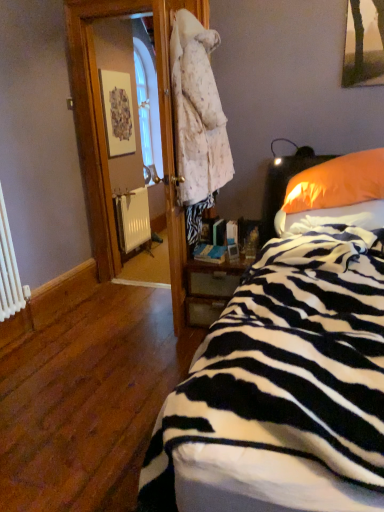
Question: Considering the relative sizes of white matte radiator at lower left and zebra-patterned fabric at lower right in the image provided, is white matte radiator at lower left smaller than zebra-patterned fabric at lower right?

Choices:
 (A) no
 (B) yes

Answer: (B)

Question: Is white matte radiator at lower left to the left of zebra-patterned fabric at lower right from the viewer's perspective?

Choices:
 (A) no
 (B) yes

Answer: (B)

Question: Could zebra-patterned fabric at lower right be considered to be inside white matte radiator at lower left?

Choices:
 (A) yes
 (B) no

Answer: (B)

Question: Is white matte radiator at lower left bigger than zebra-patterned fabric at lower right?

Choices:
 (A) no
 (B) yes

Answer: (A)

Question: Is white matte radiator at lower left wider than zebra-patterned fabric at lower right?

Choices:
 (A) no
 (B) yes

Answer: (A)

Question: Does white matte radiator at lower left have a lesser width compared to zebra-patterned fabric at lower right?

Choices:
 (A) yes
 (B) no

Answer: (A)

Question: From a real-world perspective, is orange fabric pillow at right physically above white matte radiator at lower left?

Choices:
 (A) yes
 (B) no

Answer: (A)

Question: From the image's perspective, does orange fabric pillow at right appear lower than white matte radiator at lower left?

Choices:
 (A) yes
 (B) no

Answer: (B)

Question: Considering the relative sizes of orange fabric pillow at right and white matte radiator at lower left in the image provided, is orange fabric pillow at right wider than white matte radiator at lower left?

Choices:
 (A) yes
 (B) no

Answer: (A)

Question: Considering the relative sizes of orange fabric pillow at right and white matte radiator at lower left in the image provided, is orange fabric pillow at right bigger than white matte radiator at lower left?

Choices:
 (A) yes
 (B) no

Answer: (A)

Question: From the image's perspective, is orange fabric pillow at right located above white matte radiator at lower left?

Choices:
 (A) no
 (B) yes

Answer: (B)

Question: From a real-world perspective, is orange fabric pillow at right positioned under white matte radiator at lower left based on gravity?

Choices:
 (A) no
 (B) yes

Answer: (A)

Question: Is zebra-patterned fabric at lower right at the right side of wooden nightstand at center?

Choices:
 (A) no
 (B) yes

Answer: (B)